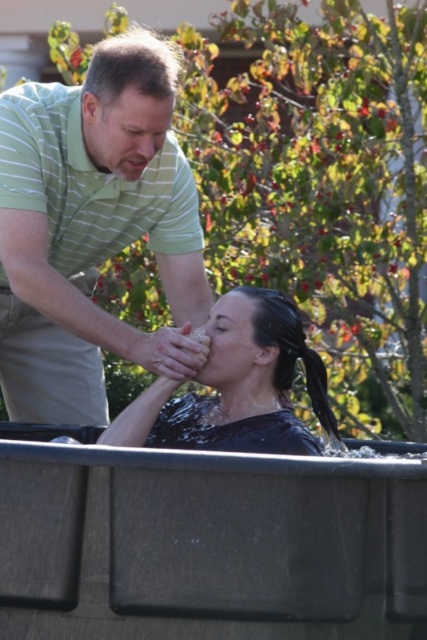
Question: Does green striped shirt at upper left appear on the right side of green striped polo shirt at upper left?

Choices:
 (A) yes
 (B) no

Answer: (B)

Question: Is green striped polo shirt at upper left further to the viewer compared to smooth skin hand at upper center?

Choices:
 (A) no
 (B) yes

Answer: (B)

Question: Which is farther from the green striped shirt at upper left?

Choices:
 (A) smooth skin forehead at upper center
 (B) black shiny hair at upper center
 (C) smooth skin hand at upper center
 (D) green striped polo shirt at upper left

Answer: (B)

Question: Which point is closer to the camera?

Choices:
 (A) (122, 97)
 (B) (316, 376)
 (C) (239, 307)
 (D) (222, 403)

Answer: (B)

Question: Does smooth skin hand at upper center have a larger size compared to black shiny hair at upper center?

Choices:
 (A) no
 (B) yes

Answer: (A)

Question: Which of the following is the farthest from the observer?

Choices:
 (A) (43, 387)
 (B) (170, 116)
 (C) (180, 173)
 (D) (315, 410)

Answer: (A)